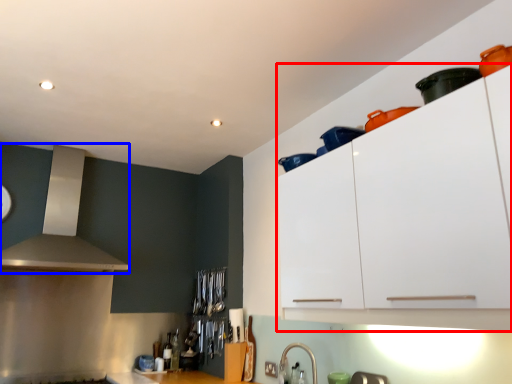
Question: Among these objects, which one is nearest to the camera, cabinetry (highlighted by a red box) or vent (highlighted by a blue box)?

Choices:
 (A) cabinetry
 (B) vent

Answer: (A)